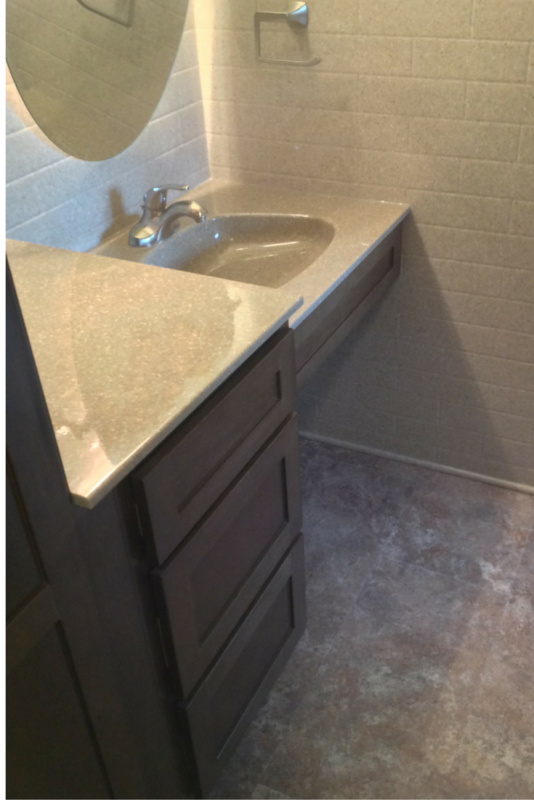
At what (x,y) coordinates should I click in order to perform the action: click on countertop. Please return your answer as a coordinate pair (x, y). Looking at the image, I should click on (89, 461).